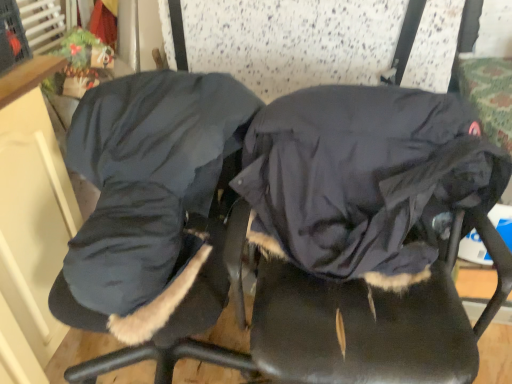
Question: Considering the positions of velvet-like dark blue coat at center and dark blue fleece sleeping bag at center in the image, is velvet-like dark blue coat at center taller or shorter than dark blue fleece sleeping bag at center?

Choices:
 (A) tall
 (B) short

Answer: (A)

Question: From the image's perspective, relative to dark blue fleece sleeping bag at center, is velvet-like dark blue coat at center above or below?

Choices:
 (A) below
 (B) above

Answer: (A)

Question: Estimate the real-world distances between objects in this image. Which object is farther from the dark blue fleece sleeping bag at center?

Choices:
 (A) dark gray fabric coat at center
 (B) velvet-like dark blue coat at center

Answer: (A)

Question: Which of these objects is positioned farthest from the dark gray fabric coat at center?

Choices:
 (A) velvet-like dark blue coat at center
 (B) dark blue fleece sleeping bag at center

Answer: (A)